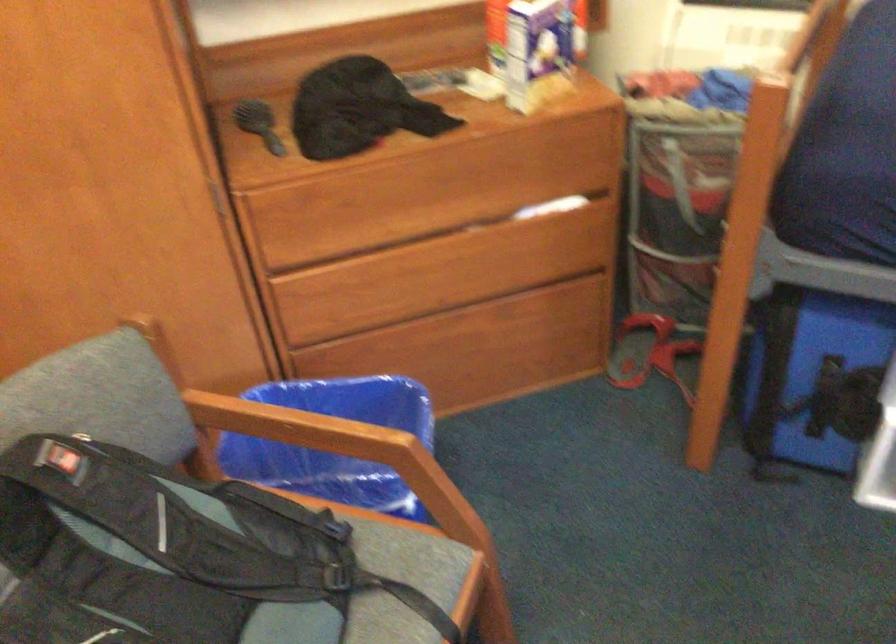
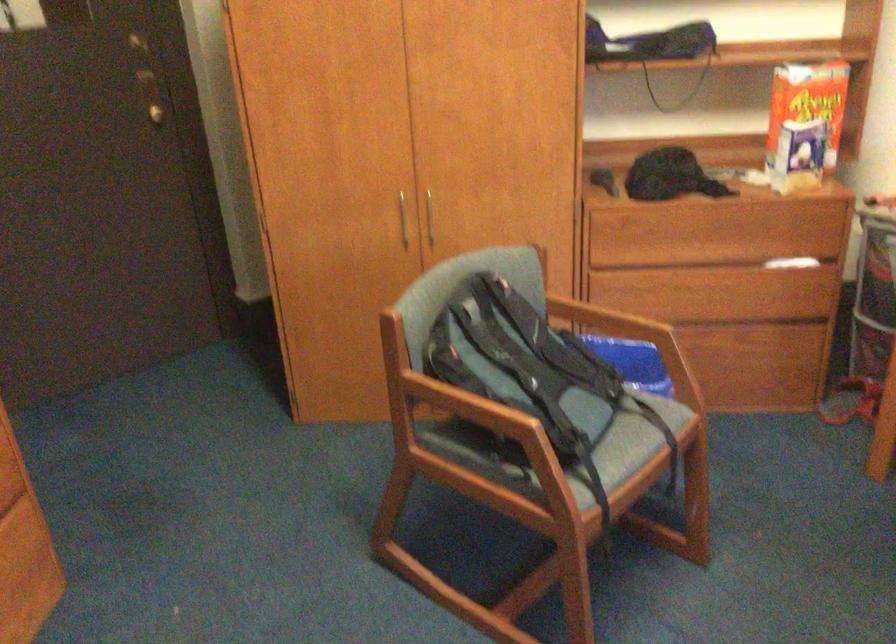
Question: How did the camera likely rotate?

Choices:
 (A) Left
 (B) Right
 (C) Up
 (D) Down

Answer: (A)